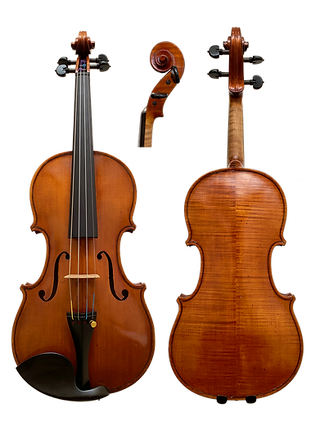
The image size is (320, 430). I want to click on knob, so click(103, 56).